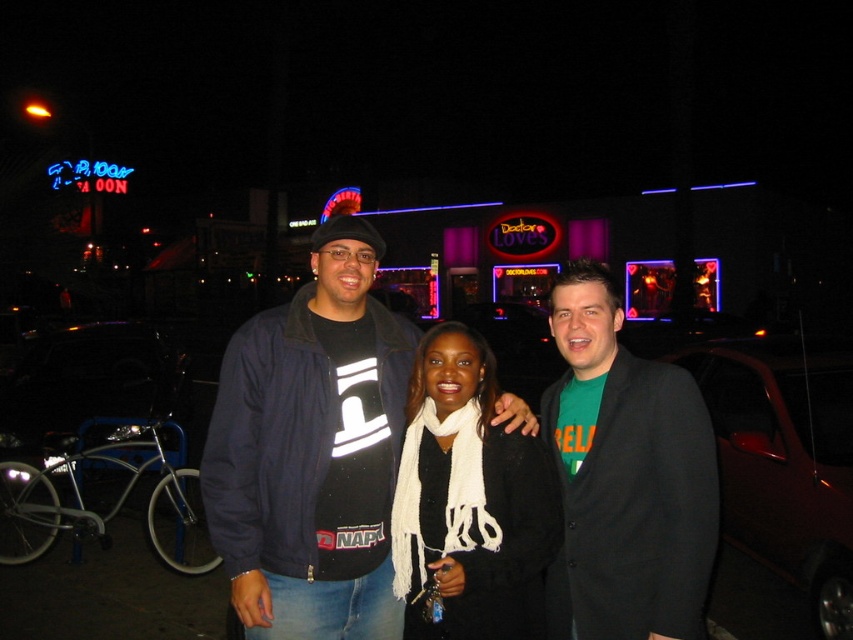
You are standing in front of the building with the signs and want to locate the dark blue jacket at center. Based on the coordinates provided, where should you look relative to the building?

The dark blue jacket at center is located at coordinates point (311,449), which means it is positioned approximately 70.3 percent from the left edge and 36.6 percent from the bottom edge of the image frame. To locate it relative to the building, you should look towards the right side and slightly above the lower middle area of the building structure.

You are a photographer trying to capture a clear shot of the white knitted scarf at center. Since the dark blue jacket at center is covering part of it, can you still see the scarf?

The dark blue jacket at center is positioned over white knitted scarf at center, so the scarf is partially or fully hidden by the jacket and might not be fully visible in the photo.

From the picture: You are a delivery person who needs to place a package between the dark blue jacket at center and the dark red metallic car at right. The package requires a minimum of 10 feet of space to be safely placed. Can you fit the package between them?

The dark blue jacket at center and dark red metallic car at right are 9.76 feet apart from each other, which is less than the required 10 feet. Therefore, the package cannot be safely placed between them.